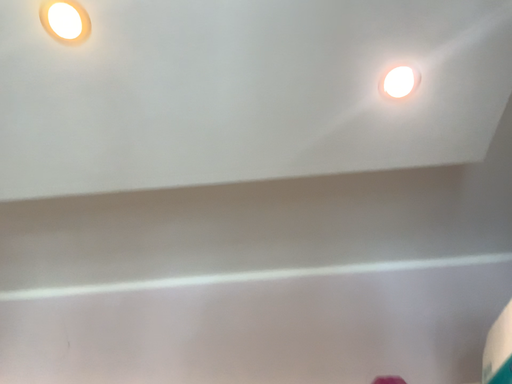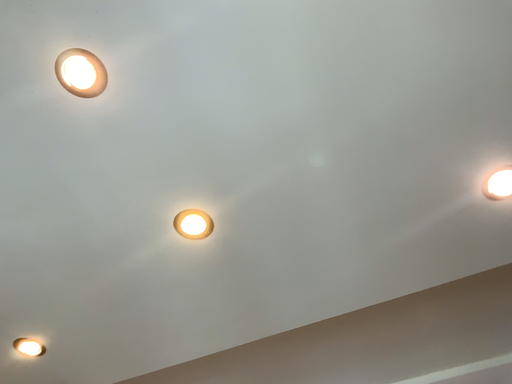
Question: Which way did the camera rotate in the video?

Choices:
 (A) rotated left
 (B) rotated right

Answer: (A)